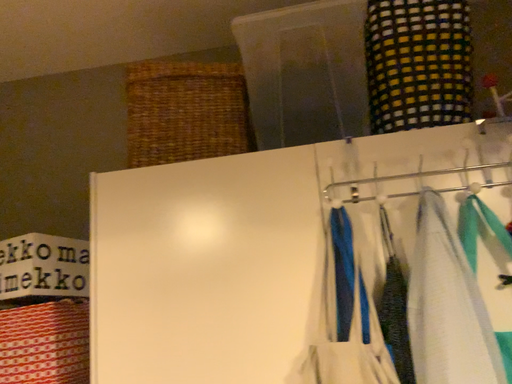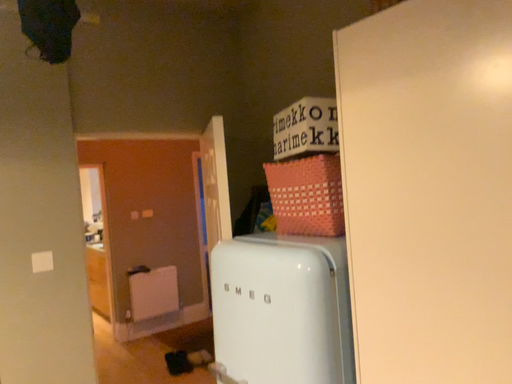
Question: Which way did the camera rotate in the video?

Choices:
 (A) rotated upward
 (B) rotated downward

Answer: (B)